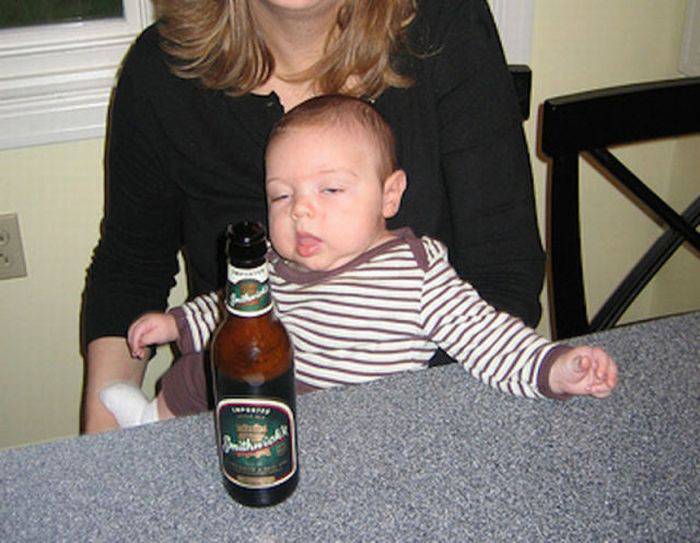
In order to click on table in this screenshot , I will do `click(463, 478)`.